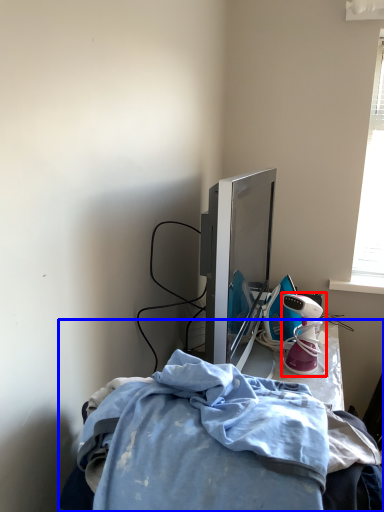
Question: Which object appears farthest to the camera in this image, toy (highlighted by a red box) or furniture (highlighted by a blue box)?

Choices:
 (A) toy
 (B) furniture

Answer: (A)